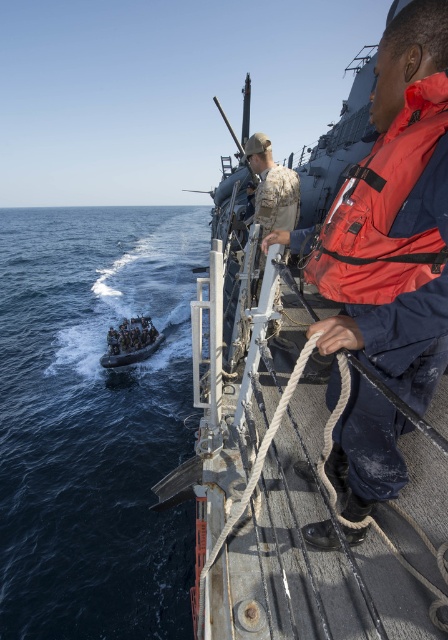
Based on the photo, what is the exact coordinate of the rustic wooden boat at center?

The rustic wooden boat at center is located at point [392,218].

You are on a navy ship and need to secure a connection between the rustic wooden boat at center and the red matte life jacket at upper right. Which object should you prioritize securing first based on their spatial relationship?

The rustic wooden boat at center is in front of the red matte life jacket at upper right, so you should prioritize securing the rustic wooden boat at center first as it is closer and obstructing access to the life jacket.

You are a safety inspector on the navy ship and need to ensure that all life jackets are properly sized for crew members. Given that the red matte life jacket at upper right and the dark blue fabric life vest at lower center are both available, which one would you recommend for a crew member who requires a larger size?

The dark blue fabric life vest at lower center should be recommended because it occupies more space than the red matte life jacket at upper right, indicating it is larger in size.